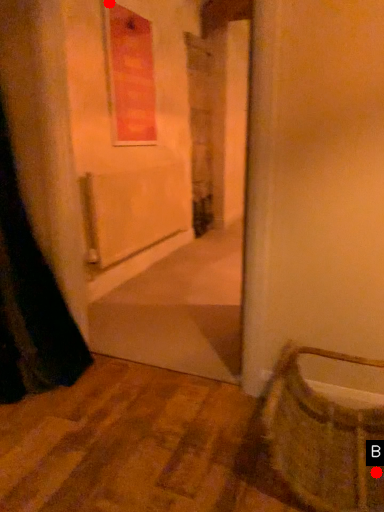
Question: Two points are circled on the image, labeled by A and B beside each circle. Which point appears closest to the camera in this image?

Choices:
 (A) A is closer
 (B) B is closer

Answer: (B)